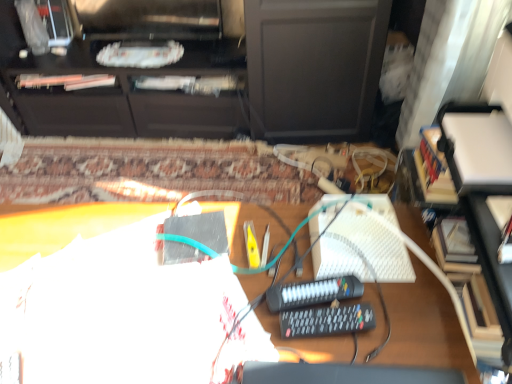
Identify the location of free space in front of black plastic remote control at center, which appears as the second equipment when viewed from the front. (332, 359).